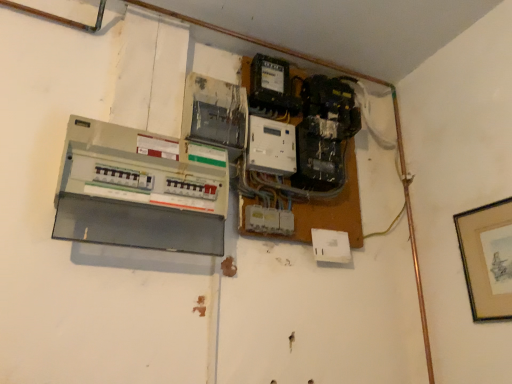
Where is `wooden framed artwork at right`? This screenshot has width=512, height=384. wooden framed artwork at right is located at coordinates (486, 259).

What is the approximate width of wooden framed artwork at right?

wooden framed artwork at right is 3.34 centimeters wide.

The height and width of the screenshot is (384, 512). Describe the element at coordinates (486, 259) in the screenshot. I see `wooden framed artwork at right` at that location.

At what (x,y) coordinates should I click in order to perform the action: click on wooden framed artwork at right. Please return your answer as a coordinate pair (x, y). The image size is (512, 384). Looking at the image, I should click on (486, 259).